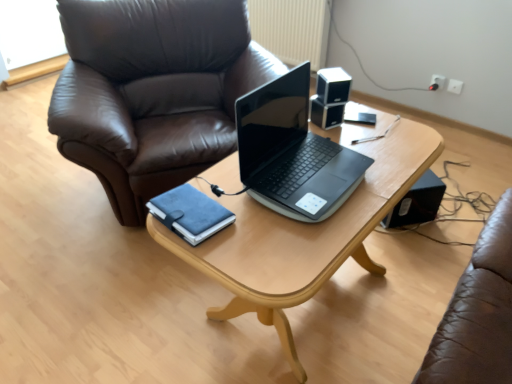
Identify the location of empty space that is ontop of suede blue notebook at center (from a real-world perspective). The width and height of the screenshot is (512, 384). (187, 204).